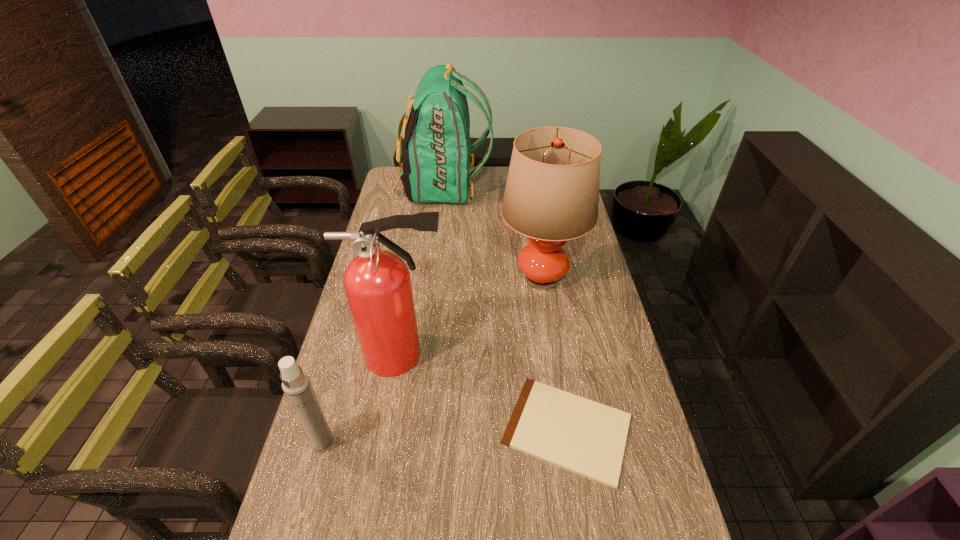
Where is `blank space that satisfies the following two spatial constraints: 1. on the back side of the lamp; 2. on the left side of the second shortest object`? The height and width of the screenshot is (540, 960). blank space that satisfies the following two spatial constraints: 1. on the back side of the lamp; 2. on the left side of the second shortest object is located at coordinates (369, 279).

In order to click on free point that satisfies the following two spatial constraints: 1. on the back of the shortest object; 2. on the right side of the backpack in this screenshot , I will do `click(416, 429)`.